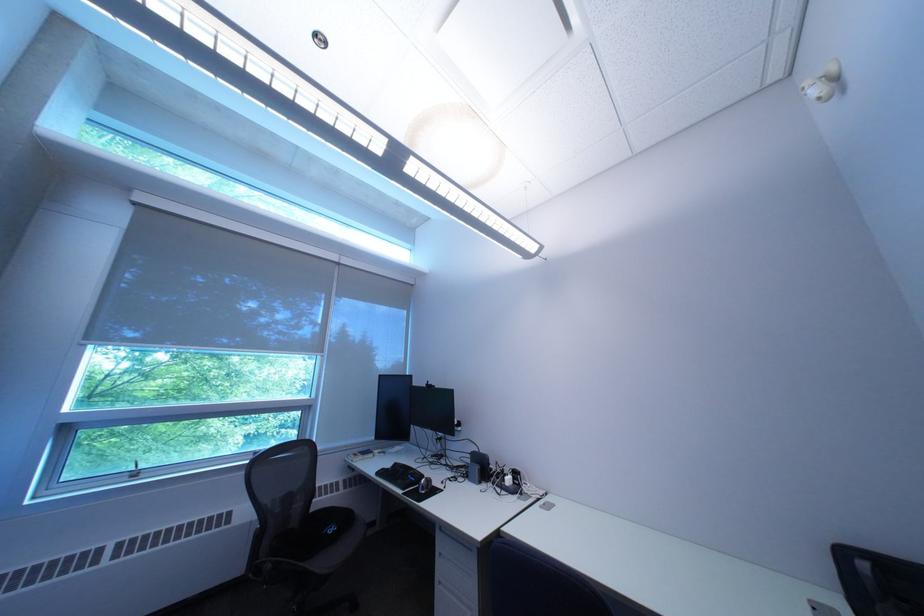
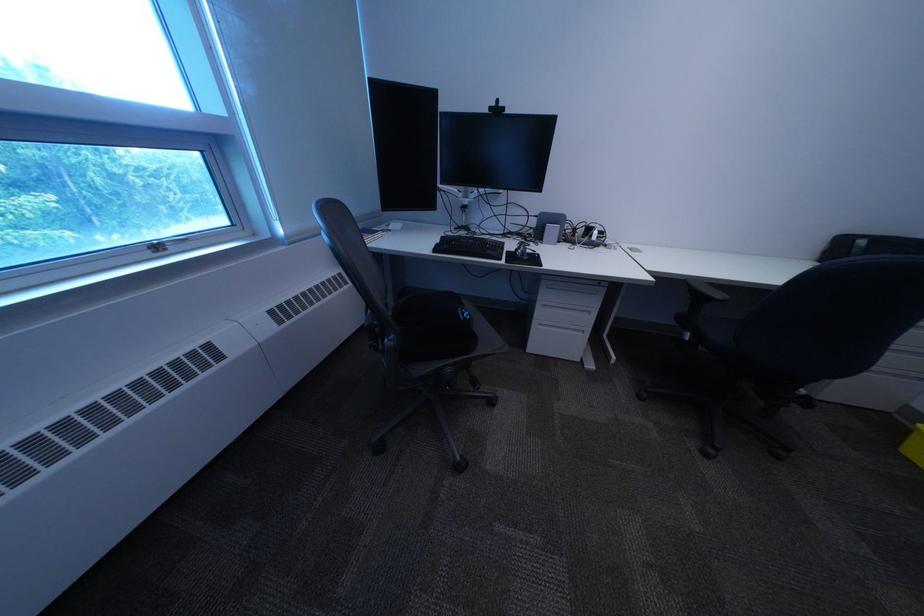
Where in the second image is the point corresponding to (440,387) from the first image?

(503, 113)